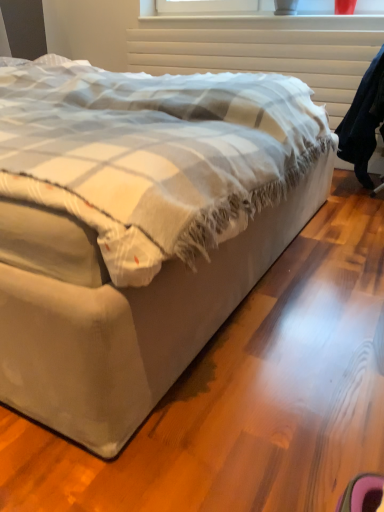
Identify the location of beige fabric bed at center. The image size is (384, 512). (145, 226).

Where is `robe to the right of white textured radiator at upper center`? The image size is (384, 512). robe to the right of white textured radiator at upper center is located at coordinates (363, 121).

From a real-world perspective, between white textured radiator at upper center and dark blue fabric robe at right, who is vertically lower?

dark blue fabric robe at right is physically lower.

Is white textured radiator at upper center smaller than dark blue fabric robe at right?

Correct, white textured radiator at upper center occupies less space than dark blue fabric robe at right.

Relative to dark blue fabric robe at right, is white textured radiator at upper center in front or behind?

white textured radiator at upper center is behind dark blue fabric robe at right.

You are a GUI agent. You are given a task and a screenshot of the screen. Output one action in this format:
    pyautogui.click(x=<x>, y=<y>)
    Task: Click on the radiator that appears above the beige fabric bed at center (from the image's perspective)
    This screenshot has height=512, width=384.
    Given the screenshot: What is the action you would take?
    pyautogui.click(x=262, y=56)

Is white textured radiator at upper center outside of beige fabric bed at center?

Yes, white textured radiator at upper center is outside of beige fabric bed at center.

From the image's perspective, relative to beige fabric bed at center, is white textured radiator at upper center above or below?

Based on their image positions, white textured radiator at upper center is located above beige fabric bed at center.

Considering the relative positions of white textured radiator at upper center and beige fabric bed at center in the image provided, is white textured radiator at upper center to the right of beige fabric bed at center from the viewer's perspective?

Correct, you'll find white textured radiator at upper center to the right of beige fabric bed at center.

From a real-world perspective, is beige fabric bed at center positioned above or below dark blue fabric robe at right?

In terms of real-world spatial position, beige fabric bed at center is above dark blue fabric robe at right.

Between beige fabric bed at center and dark blue fabric robe at right, which one appears on the right side from the viewer's perspective?

From the viewer's perspective, dark blue fabric robe at right appears more on the right side.

Which object is thinner, beige fabric bed at center or dark blue fabric robe at right?

dark blue fabric robe at right is thinner.

From a real-world perspective, which object rests below the other?

From a 3D spatial view, dark blue fabric robe at right is below.

Would you say dark blue fabric robe at right is to the left or to the right of beige fabric bed at center in the picture?

dark blue fabric robe at right is to the right of beige fabric bed at center.

Can you confirm if dark blue fabric robe at right is shorter than beige fabric bed at center?

Yes, dark blue fabric robe at right is shorter than beige fabric bed at center.

Locate an element on the screen. Image resolution: width=384 pixels, height=512 pixels. robe to the right of beige fabric bed at center is located at coordinates (363, 121).

Locate an element on the screen. radiator above the beige fabric bed at center (from the image's perspective) is located at coordinates (262, 56).

How far apart are beige fabric bed at center and white textured radiator at upper center?

The distance of beige fabric bed at center from white textured radiator at upper center is 1.43 meters.

Is beige fabric bed at center placed right next to white textured radiator at upper center?

beige fabric bed at center and white textured radiator at upper center are not in contact.

Is beige fabric bed at center taller or shorter than white textured radiator at upper center?

In the image, beige fabric bed at center appears to be taller than white textured radiator at upper center.

Which object is closer to the camera taking this photo, dark blue fabric robe at right or white textured radiator at upper center?

Positioned in front is dark blue fabric robe at right.

Can you confirm if dark blue fabric robe at right is taller than white textured radiator at upper center?

Yes, dark blue fabric robe at right is taller than white textured radiator at upper center.

From the image's perspective, which object appears higher, dark blue fabric robe at right or white textured radiator at upper center?

From the image's view, white textured radiator at upper center is above.

Consider the image. Can we say dark blue fabric robe at right lies outside white textured radiator at upper center?

Yes, dark blue fabric robe at right is outside of white textured radiator at upper center.

The width and height of the screenshot is (384, 512). Find the location of `radiator that appears on the left of dark blue fabric robe at right`. radiator that appears on the left of dark blue fabric robe at right is located at coordinates (262, 56).

In order to click on radiator above the beige fabric bed at center (from the image's perspective) in this screenshot , I will do `click(262, 56)`.

Looking at the image, which one is located closer to beige fabric bed at center, white textured radiator at upper center or dark blue fabric robe at right?

dark blue fabric robe at right is positioned closer to the anchor beige fabric bed at center.

Estimate the real-world distances between objects in this image. Which object is further from white textured radiator at upper center, dark blue fabric robe at right or beige fabric bed at center?

beige fabric bed at center is further to white textured radiator at upper center.

Based on their spatial positions, is dark blue fabric robe at right or white textured radiator at upper center closer to beige fabric bed at center?

The object closer to beige fabric bed at center is dark blue fabric robe at right.

Which object lies nearer to the anchor point white textured radiator at upper center, beige fabric bed at center or dark blue fabric robe at right?

Based on the image, dark blue fabric robe at right appears to be nearer to white textured radiator at upper center.

Considering their positions, is beige fabric bed at center positioned closer to dark blue fabric robe at right than white textured radiator at upper center?

Based on the image, white textured radiator at upper center appears to be nearer to dark blue fabric robe at right.

Looking at the image, which one is located further to dark blue fabric robe at right, white textured radiator at upper center or beige fabric bed at center?

Among the two, beige fabric bed at center is located further to dark blue fabric robe at right.

I want to click on robe between beige fabric bed at center and white textured radiator at upper center along the z-axis, so click(x=363, y=121).